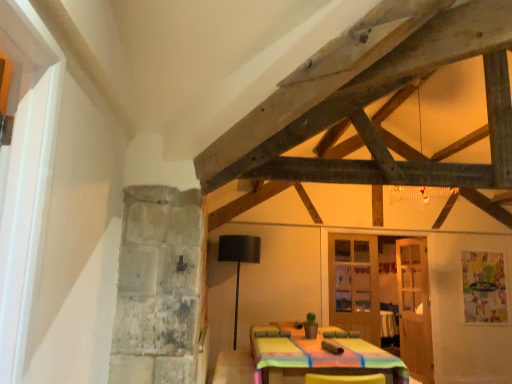
This screenshot has width=512, height=384. Describe the element at coordinates (414, 308) in the screenshot. I see `wooden door at right, which is the 3th door from front to back` at that location.

This screenshot has height=384, width=512. I want to click on wooden glass door at center, acting as the 1th door starting from the front, so click(x=414, y=307).

What is the approximate width of matte glass door at center, the 2th door positioned from the front?

The width of matte glass door at center, the 2th door positioned from the front, is 2.13 inches.

Identify the location of wooden door at right, which is the 3th door from front to back. The height and width of the screenshot is (384, 512). (414, 308).

Does point (236, 252) come in front of point (417, 315)?

Yes, it is.

From the image's perspective, which is above, black matte lamp at center or wooden door at right, which is the 3th door from front to back?

From the image's view, black matte lamp at center is above.

From a real-world perspective, which is physically above, black matte lamp at center or wooden door at right, acting as the first door starting from the back?

wooden door at right, acting as the first door starting from the back, is physically above.

Is there a large distance between black matte lamp at center and wooden door at right, acting as the first door starting from the back?

Indeed, black matte lamp at center is not near wooden door at right, acting as the first door starting from the back.

Which object is positioned more to the left, black matte lamp at center or matte glass door at center, the 2th door positioned from the front?

black matte lamp at center is more to the left.

Does black matte lamp at center have a lesser width compared to matte glass door at center, which is the 2th door from back to front?

No.

Does point (236, 256) appear closer or farther from the camera than point (333, 266)?

Clearly, point (236, 256) is closer to the camera than point (333, 266).

Could you tell me if matte glass door at center, which is the 2th door from back to front, is facing black matte lamp at center?

No, matte glass door at center, which is the 2th door from back to front, is not aimed at black matte lamp at center.

Considering the sizes of objects matte glass door at center, which is the 2th door from back to front, and black matte lamp at center in the image provided, who is taller, matte glass door at center, which is the 2th door from back to front, or black matte lamp at center?

black matte lamp at center is taller.

Which object is wider, matte glass door at center, the 2th door positioned from the front, or black matte lamp at center?

With larger width is black matte lamp at center.

Looking at this image, relative to black matte lamp at center, is matte glass door at center, the 2th door positioned from the front, in front or behind?

In the image, matte glass door at center, the 2th door positioned from the front, appears behind black matte lamp at center.

From a real-world perspective, between wooden door at right, acting as the first door starting from the back, and matte glass door at center, the 2th door positioned from the front, who is vertically higher?

matte glass door at center, the 2th door positioned from the front.

Between wooden door at right, which is the 3th door from front to back, and matte glass door at center, which is the 2th door from back to front, which one has smaller width?

matte glass door at center, which is the 2th door from back to front.

Measure the distance between wooden door at right, acting as the first door starting from the back, and matte glass door at center, the 2th door positioned from the front.

wooden door at right, acting as the first door starting from the back, is 20.97 inches from matte glass door at center, the 2th door positioned from the front.

Does wooden door at right, acting as the first door starting from the back, lie behind matte glass door at center, which is the 2th door from back to front?

Yes, wooden door at right, acting as the first door starting from the back, is further from the camera.

Between wooden door at right, which is the 3th door from front to back, and black matte lamp at center, which one appears on the left side from the viewer's perspective?

Positioned to the left is black matte lamp at center.

Which object is thinner, wooden door at right, acting as the first door starting from the back, or black matte lamp at center?

wooden door at right, acting as the first door starting from the back.

Which object is more forward, wooden door at right, which is the 3th door from front to back, or black matte lamp at center?

Positioned in front is black matte lamp at center.

Do you think wooden door at right, which is the 3th door from front to back, is within black matte lamp at center, or outside of it?

wooden door at right, which is the 3th door from front to back, is not inside black matte lamp at center, it's outside.

Would you say black matte lamp at center is inside or outside wooden glass door at center, acting as the 1th door starting from the front?

black matte lamp at center is spatially situated outside wooden glass door at center, acting as the 1th door starting from the front.

Would you say black matte lamp at center is a long distance from wooden glass door at center, acting as the 1th door starting from the front?

Yes, black matte lamp at center and wooden glass door at center, acting as the 1th door starting from the front, are quite far apart.

In the scene shown: From a real-world perspective, is black matte lamp at center physically located above or below wooden glass door at center, acting as the 1th door starting from the front?

black matte lamp at center is below wooden glass door at center, acting as the 1th door starting from the front.

From the image's perspective, between black matte lamp at center and wooden glass door at center, acting as the 1th door starting from the front, who is located below?

wooden glass door at center, acting as the 1th door starting from the front, is shown below in the image.

Is point (353, 248) more distant than point (426, 302)?

Yes, it is.

Would you consider matte glass door at center, the 2th door positioned from the front, to be distant from wooden glass door at center, the third door in the back-to-front sequence?

matte glass door at center, the 2th door positioned from the front, is near wooden glass door at center, the third door in the back-to-front sequence, not far away.

Which is more to the left, matte glass door at center, which is the 2th door from back to front, or wooden glass door at center, the third door in the back-to-front sequence?

Positioned to the left is matte glass door at center, which is the 2th door from back to front.

This screenshot has width=512, height=384. In order to click on lamp that appears above the wooden door at right, acting as the first door starting from the back (from the image's perspective) in this screenshot , I will do `click(238, 261)`.

Locate an element on the screen. lamp to the left of matte glass door at center, the 2th door positioned from the front is located at coordinates (238, 261).

Based on their spatial positions, is wooden door at right, acting as the first door starting from the back, or wooden glass door at center, the third door in the back-to-front sequence, closer to black matte lamp at center?

Based on the image, wooden glass door at center, the third door in the back-to-front sequence, appears to be nearer to black matte lamp at center.

Which object lies further to the anchor point wooden glass door at center, the third door in the back-to-front sequence, wooden door at right, acting as the first door starting from the back, or black matte lamp at center?

black matte lamp at center is further to wooden glass door at center, the third door in the back-to-front sequence.

From the picture: When comparing their distances from wooden glass door at center, the third door in the back-to-front sequence, does matte glass door at center, the 2th door positioned from the front, or black matte lamp at center seem closer?

matte glass door at center, the 2th door positioned from the front, is closer to wooden glass door at center, the third door in the back-to-front sequence.

Looking at the image, which one is located closer to matte glass door at center, which is the 2th door from back to front, wooden door at right, which is the 3th door from front to back, or wooden glass door at center, the third door in the back-to-front sequence?

Among the two, wooden glass door at center, the third door in the back-to-front sequence, is located nearer to matte glass door at center, which is the 2th door from back to front.

When comparing their distances from wooden glass door at center, acting as the 1th door starting from the front, does black matte lamp at center or matte glass door at center, the 2th door positioned from the front, seem further?

Among the two, black matte lamp at center is located further to wooden glass door at center, acting as the 1th door starting from the front.

Which object lies nearer to the anchor point wooden door at right, which is the 3th door from front to back, wooden glass door at center, the third door in the back-to-front sequence, or matte glass door at center, the 2th door positioned from the front?

wooden glass door at center, the third door in the back-to-front sequence.

Looking at the image, which one is located closer to matte glass door at center, which is the 2th door from back to front, black matte lamp at center or wooden door at right, which is the 3th door from front to back?

The object closer to matte glass door at center, which is the 2th door from back to front, is wooden door at right, which is the 3th door from front to back.

Considering their positions, is black matte lamp at center positioned further to matte glass door at center, the 2th door positioned from the front, than wooden glass door at center, acting as the 1th door starting from the front?

black matte lamp at center.

Find the location of `door located between black matte lamp at center and wooden glass door at center, acting as the 1th door starting from the front, in the left-right direction`. door located between black matte lamp at center and wooden glass door at center, acting as the 1th door starting from the front, in the left-right direction is located at coordinates (354, 284).

I want to click on door between matte glass door at center, which is the 2th door from back to front, and wooden door at right, which is the 3th door from front to back, so click(x=414, y=307).